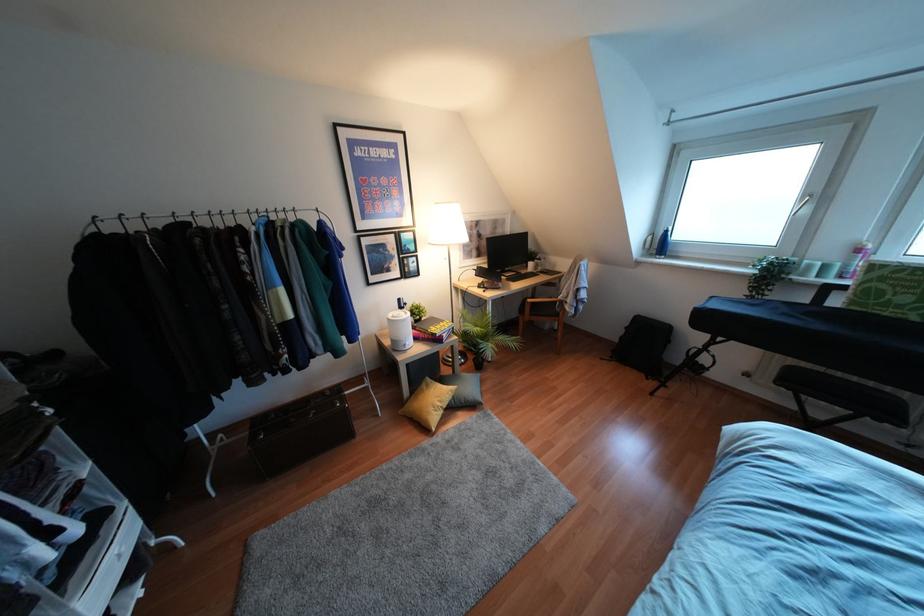
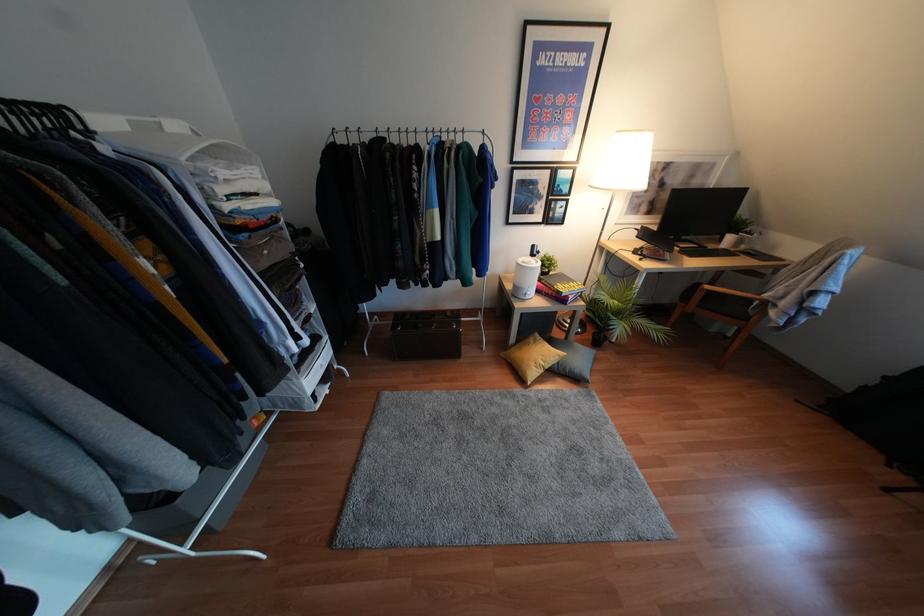
Find the pixel in the second image that matches (x=441, y=323) in the first image.

(570, 283)